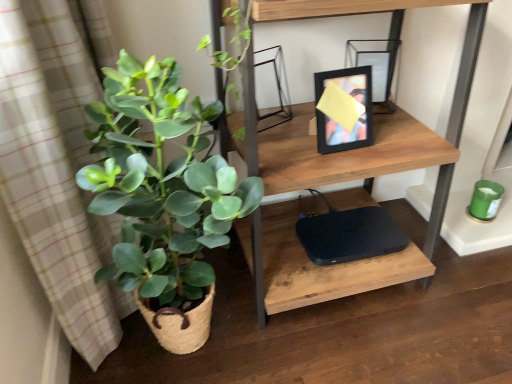
Question: Is wooden shelf at upper center situated inside green woven basket at left or outside?

Choices:
 (A) inside
 (B) outside

Answer: (B)

Question: From a real-world perspective, is wooden shelf at upper center above or below green woven basket at left?

Choices:
 (A) below
 (B) above

Answer: (B)

Question: Which object is positioned farthest from the black matte computer at lower center?

Choices:
 (A) wooden shelf at upper center
 (B) green woven basket at left

Answer: (B)

Question: Based on their relative distances, which object is farther from the green woven basket at left?

Choices:
 (A) black matte computer at lower center
 (B) wooden shelf at upper center

Answer: (A)